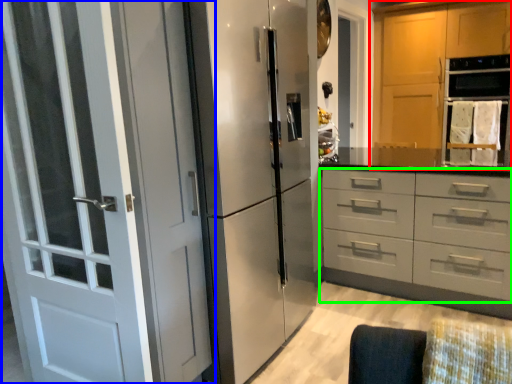
Question: Estimate the real-world distances between objects in this image. Which object is farther from cabinetry (highlighted by a red box), door (highlighted by a blue box) or drawer (highlighted by a green box)?

Choices:
 (A) door
 (B) drawer

Answer: (A)